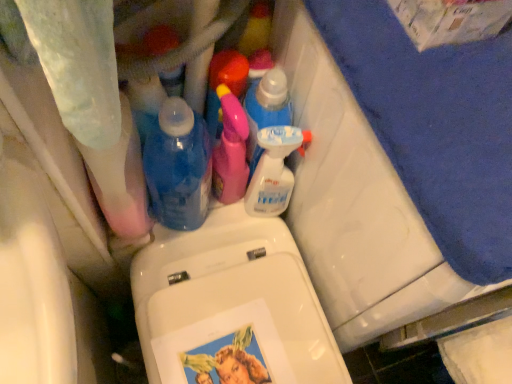
Question: Is pink plastic spray bottle at center, which ranks as the 4th cleaning product in right-to-left order, to the left or to the right of blue fabric bath towel at upper right in the image?

Choices:
 (A) left
 (B) right

Answer: (A)

Question: In terms of width, does pink plastic spray bottle at center, which ranks as the 4th cleaning product in right-to-left order, look wider or thinner when compared to blue fabric bath towel at upper right?

Choices:
 (A) thin
 (B) wide

Answer: (A)

Question: Which object is the farthest from the transparent plastic bottle at center?

Choices:
 (A) translucent plastic spray bottle at center, marked as the 2th cleaning product in a right-to-left arrangement
 (B) pink plastic spray bottle at center, positioned as the first cleaning product in left-to-right order
 (C) blue fabric bath towel at upper right
 (D) pink plastic spray bottle at center, arranged as the 2th cleaning product when viewed from the left
 (E) clear plastic spray bottle at upper center, which ranks as the first cleaning product in right-to-left order

Answer: (C)

Question: Which is nearer to the pink plastic spray bottle at center, which ranks as the 4th cleaning product in right-to-left order?

Choices:
 (A) transparent plastic bottle at center
 (B) translucent plastic spray bottle at center, placed as the third cleaning product when sorted from left to right
 (C) clear plastic spray bottle at upper center, arranged as the 4th cleaning product when viewed from the left
 (D) blue fabric bath towel at upper right
 (E) pink plastic spray bottle at center, arranged as the 2th cleaning product when viewed from the left

Answer: (B)